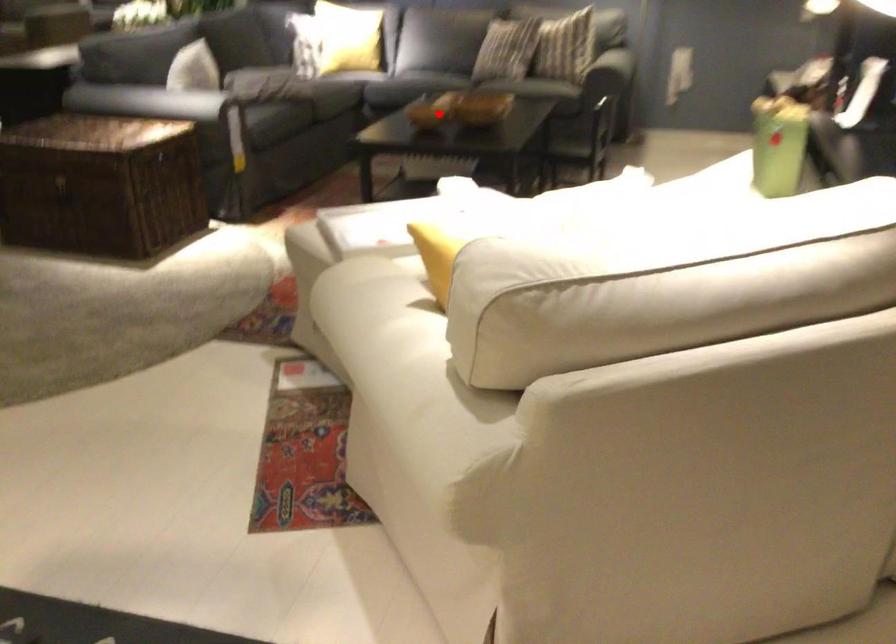
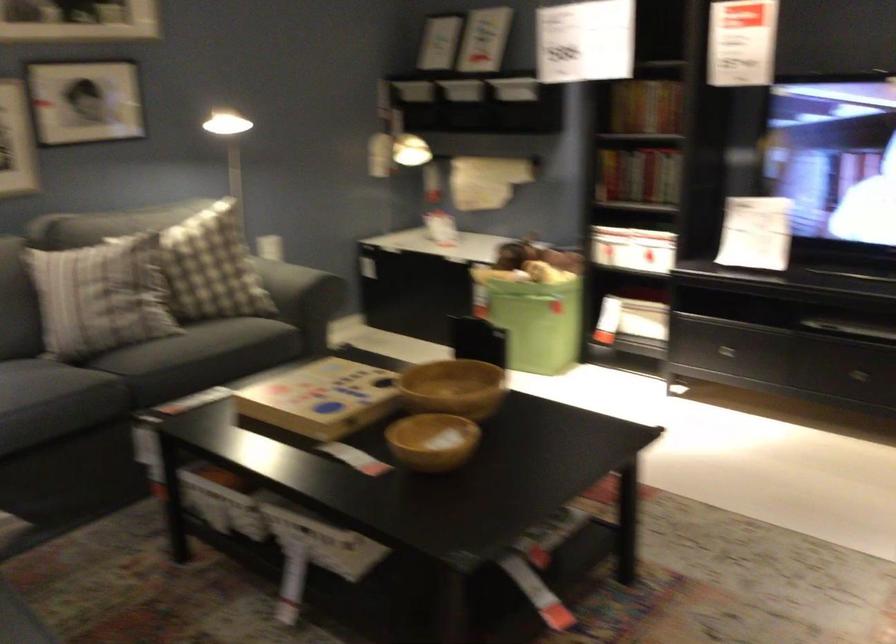
Question: I am providing you with two images of the same scene from different viewpoints. A red point is marked on the first image. At the location where the point appears in image 1, is it still visible in image 2?

Choices:
 (A) Yes
 (B) No

Answer: (A)